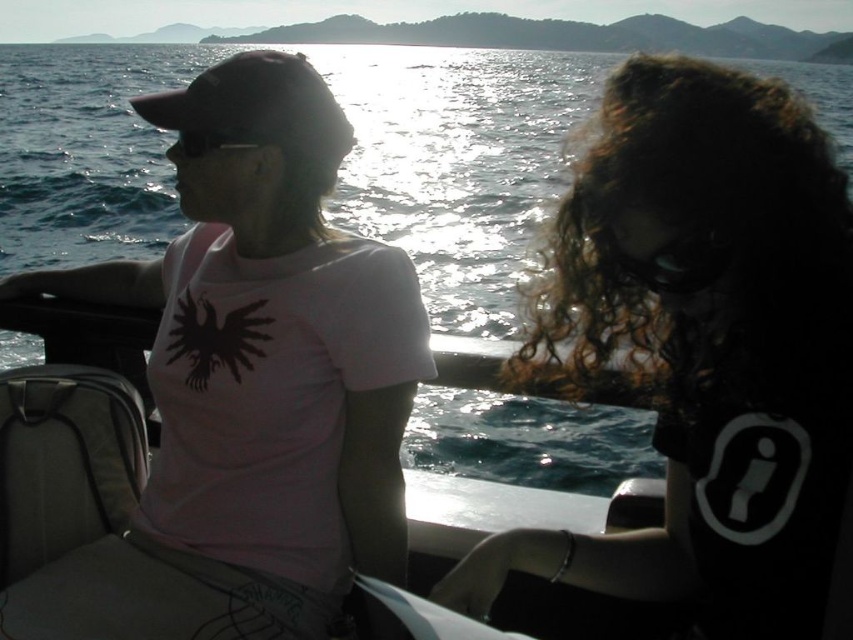
Question: Is black matte shirt at upper right positioned behind glistening water at center?

Choices:
 (A) no
 (B) yes

Answer: (A)

Question: Can you confirm if pink matte t-shirt at left is positioned below black matte shirt at upper right?

Choices:
 (A) yes
 (B) no

Answer: (B)

Question: Which object is farther from the camera taking this photo?

Choices:
 (A) black matte shirt at upper right
 (B) pink matte t-shirt at left
 (C) glistening water at center

Answer: (B)

Question: Which point is closer to the camera?

Choices:
 (A) pink matte t-shirt at left
 (B) black matte shirt at upper right

Answer: (B)

Question: Is black matte shirt at upper right thinner than glistening water at center?

Choices:
 (A) yes
 (B) no

Answer: (A)

Question: Which of the following is the closest to the observer?

Choices:
 (A) black matte shirt at upper right
 (B) glistening water at center

Answer: (A)